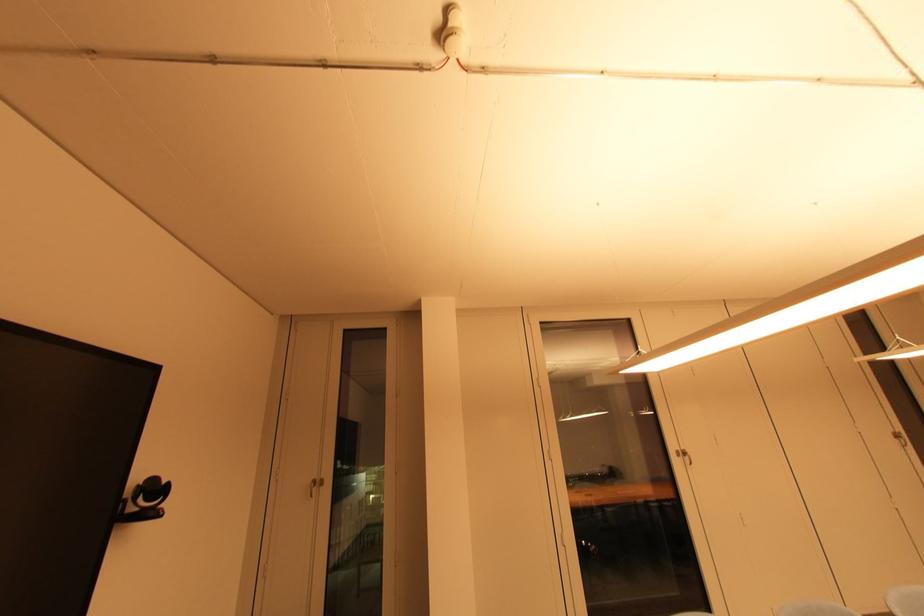
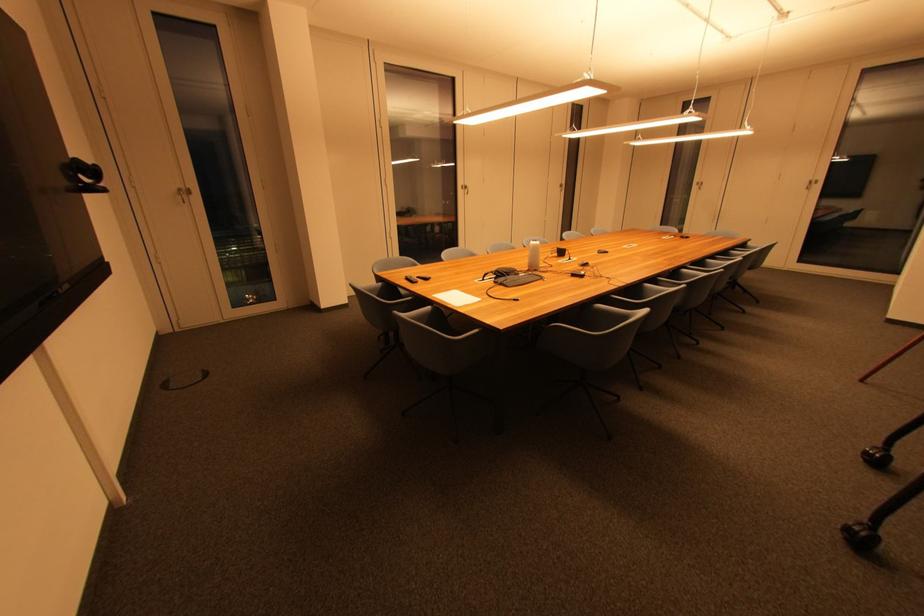
The point at (685, 458) is marked in the first image. Where is the corresponding point in the second image?

(468, 190)